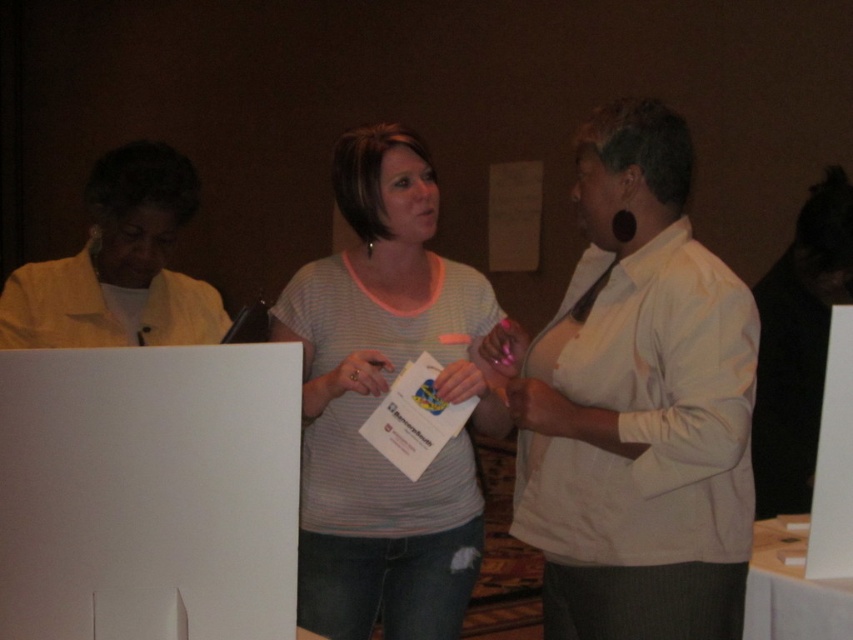
You are a photographer at the event and want to capture a clear photo of the white matte shirt at center and the light gray striped shirt at center. Which one should you focus on to ensure it appears sharp in the photo?

You should focus on the white matte shirt at center because it is in front of the light gray striped shirt at center, so focusing on the front object will keep it sharp while the background may blur.

Based on the scene description, where is the white matte shirt at center located in terms of coordinates?

The white matte shirt at center is located at coordinates point (636, 404).

You are standing in the same room and want to take a photo of the white matte shirt at center. Which direction should you move to get a better view of it?

The white matte shirt at center is located at point [636,404], so you should move towards the center of the image to get a better view of it.